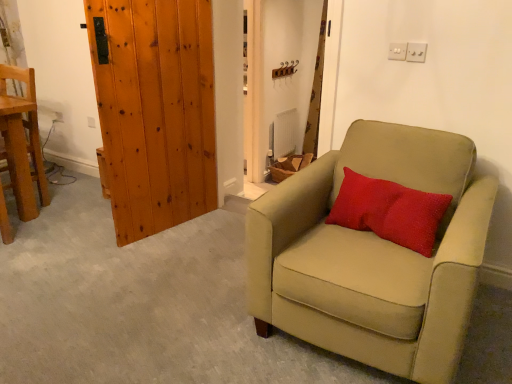
Question: Which is correct: suede beige armchair at right, which is the first chair from front to back, is inside matte brown curtain at upper center, or outside of it?

Choices:
 (A) outside
 (B) inside

Answer: (A)

Question: From the image's perspective, is suede beige armchair at right, positioned as the second chair in left-to-right order, located above or below matte brown curtain at upper center?

Choices:
 (A) below
 (B) above

Answer: (A)

Question: Estimate the real-world distances between objects in this image. Which object is closer to the red textured pillow at center?

Choices:
 (A) white plastic electric outlet at lower left
 (B) suede beige armchair at right, which is the first chair from front to back
 (C) matte brown curtain at upper center
 (D) wooden chair at left, the first chair viewed from the back
 (E) wooden plank door at left

Answer: (B)

Question: Based on their relative distances, which object is farther from the red textured pillow at center?

Choices:
 (A) wooden chair at left, the first chair viewed from the back
 (B) matte brown curtain at upper center
 (C) white plastic electric outlet at lower left
 (D) suede beige armchair at right, marked as the second chair in a back-to-front arrangement
 (E) wooden plank door at left

Answer: (B)